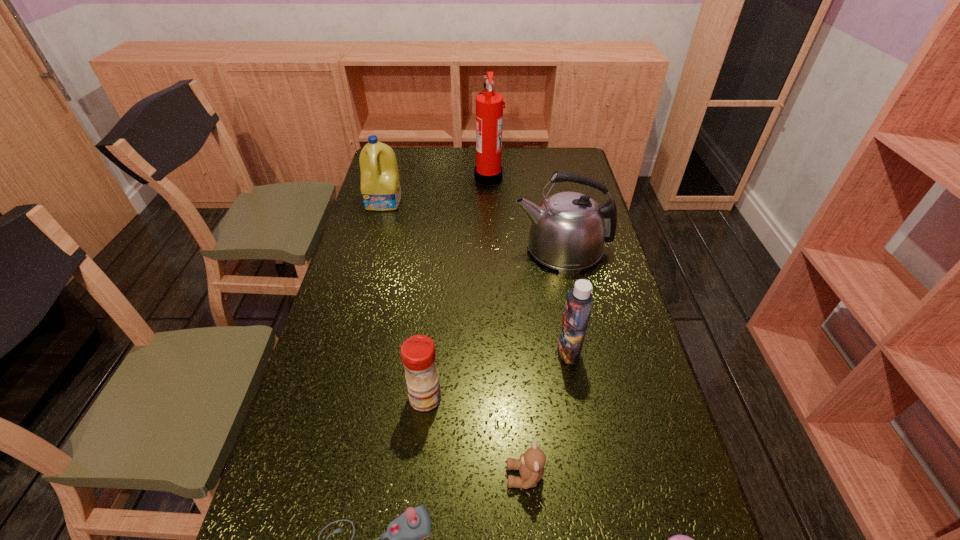
Locate an element on the screen. the tallest object is located at coordinates (489, 105).

At what (x,y) coordinates should I click in order to perform the action: click on the sixth nearest object. Please return your answer as a coordinate pair (x, y). Looking at the image, I should click on (568, 230).

The image size is (960, 540). What are the coordinates of `detergent` in the screenshot? It's located at 380,184.

This screenshot has width=960, height=540. What are the coordinates of `the fifth nearest object` in the screenshot? It's located at (579, 302).

In order to click on the fourth nearest object in this screenshot , I will do `click(418, 355)`.

Locate an element on the screen. condiment is located at coordinates (418, 355).

In order to click on teddy bear in this screenshot , I will do `click(531, 465)`.

The image size is (960, 540). I want to click on the third shortest object, so click(x=531, y=465).

Image resolution: width=960 pixels, height=540 pixels. Find the location of `vacant space located 0.330m with the nozzle aimed from the tallest object`. vacant space located 0.330m with the nozzle aimed from the tallest object is located at coordinates (395, 177).

This screenshot has height=540, width=960. Identify the location of free space located 0.310m with the nozzle aimed from the tallest object. (399, 177).